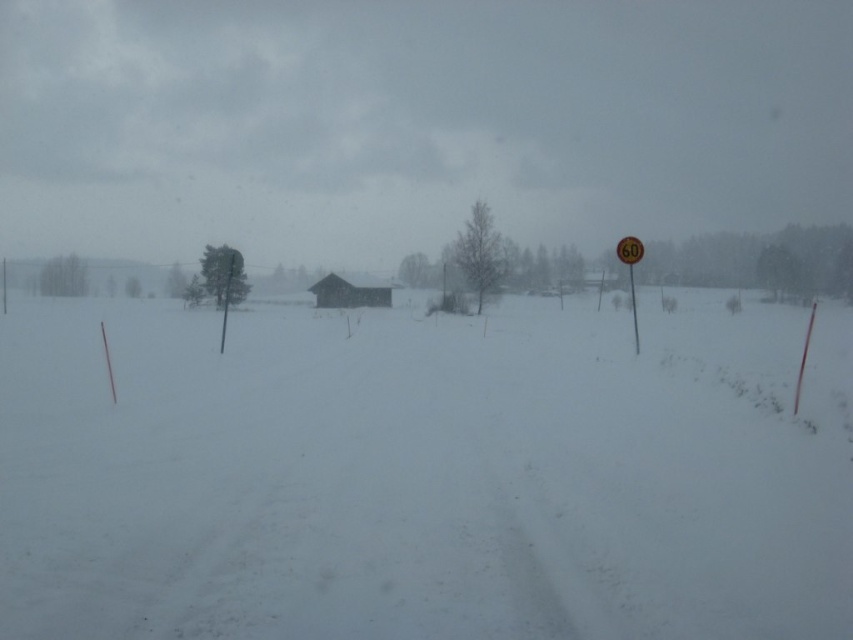
Can you confirm if brown wooden hut at center is thinner than orange reflective sign at right?

In fact, brown wooden hut at center might be wider than orange reflective sign at right.

Between brown wooden hut at center and orange reflective sign at right, which one has more height?

brown wooden hut at center is taller.

Does point (326, 292) lie behind point (619, 237)?

No, it is in front of (619, 237).

The height and width of the screenshot is (640, 853). Find the location of `brown wooden hut at center`. brown wooden hut at center is located at coordinates (347, 292).

Is the position of white powdery snow at center less distant than that of orange reflective sign at right?

Yes, it is in front of orange reflective sign at right.

Does point (213, 442) come behind point (633, 244)?

No.

Describe the element at coordinates (424, 474) in the screenshot. I see `white powdery snow at center` at that location.

Where is `white powdery snow at center`? The height and width of the screenshot is (640, 853). white powdery snow at center is located at coordinates (424, 474).

Does white powdery snow at center have a lesser width compared to brown wooden hut at center?

In fact, white powdery snow at center might be wider than brown wooden hut at center.

I want to click on white powdery snow at center, so click(x=424, y=474).